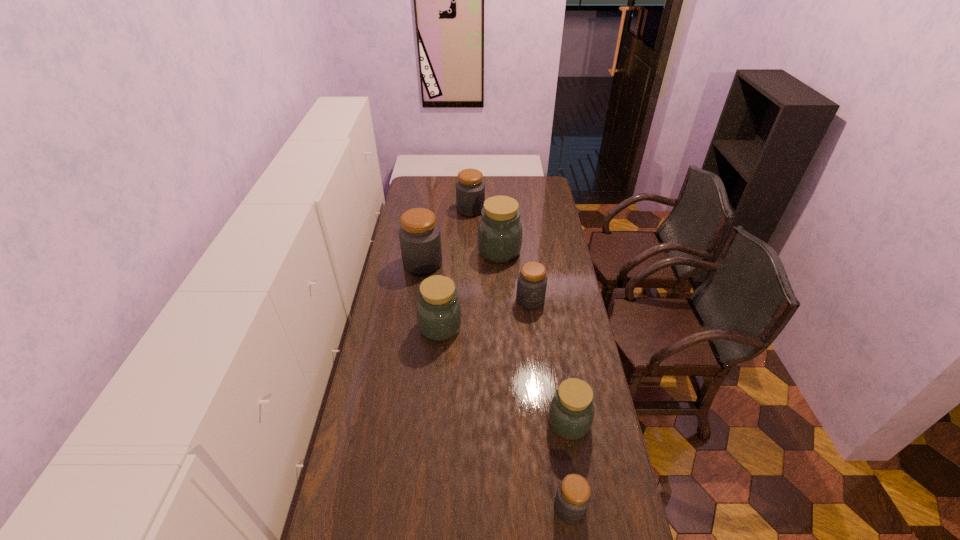
This screenshot has height=540, width=960. Identify the location of vacant space that's between the second farthest green jar and the sixth farthest object. (505, 375).

At what (x,y) coordinates should I click in order to perform the action: click on free space between the second green jar from left to right and the second smallest green jar. Please return your answer as a coordinate pair (x, y). The image size is (960, 540). Looking at the image, I should click on (469, 289).

You are a GUI agent. You are given a task and a screenshot of the screen. Output one action in this format:
    pyautogui.click(x=<x>, y=<y>)
    Task: Click on the free spot between the farthest jar and the biggest gray jar
    This screenshot has width=960, height=540.
    Given the screenshot: What is the action you would take?
    pyautogui.click(x=446, y=237)

Locate an element on the screen. empty location between the farthest green jar and the second nearest object is located at coordinates (534, 337).

Choose which object is the fifth nearest neighbor to the farthest gray jar. Please provide its 2D coordinates. Your answer should be formatted as a tuple, i.e. [(x, y)], where the tuple contains the x and y coordinates of a point satisfying the conditions above.

[(571, 413)]

Identify which object is the sixth closest to the nearest gray jar. Please provide its 2D coordinates. Your answer should be formatted as a tuple, i.e. [(x, y)], where the tuple contains the x and y coordinates of a point satisfying the conditions above.

[(470, 189)]

Select which jar is the sixth closest to the biggest gray jar. Please provide its 2D coordinates. Your answer should be formatted as a tuple, i.e. [(x, y)], where the tuple contains the x and y coordinates of a point satisfying the conditions above.

[(573, 496)]

Locate an element on the screen. jar that stands as the second closest to the third farthest gray jar is located at coordinates tap(439, 315).

Identify the location of the second closest green jar to the leftmost gray jar. This screenshot has width=960, height=540. (439, 315).

Locate an element on the screen. Image resolution: width=960 pixels, height=540 pixels. green jar that is the third closest to the nearest object is located at coordinates (499, 238).